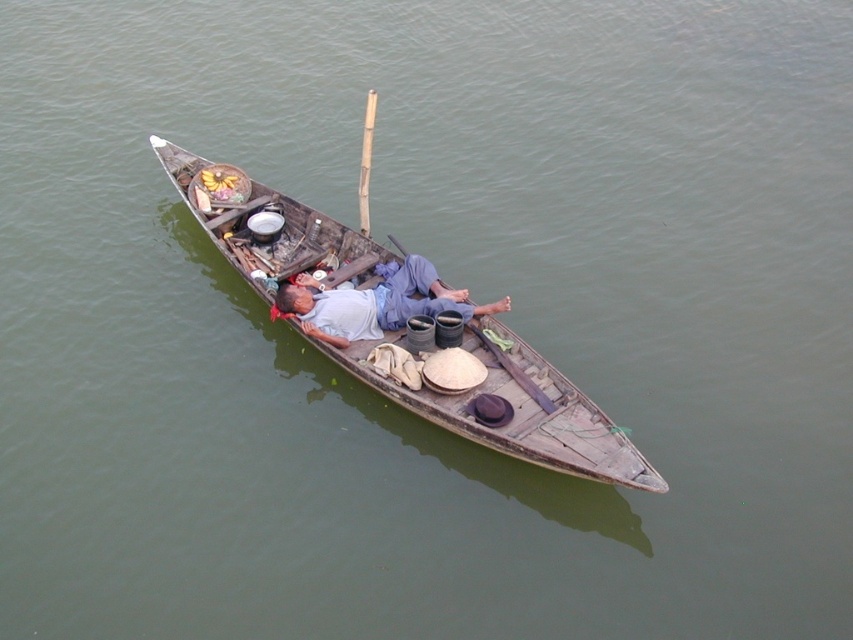
The image size is (853, 640). Identify the location of wooden boat at center. (515, 408).

Is the position of wooden boat at center less distant than that of gray fabric shirt at center?

That is True.

Measure the distance between wooden boat at center and camera.

They are 10.81 meters apart.

Identify the location of wooden boat at center. The height and width of the screenshot is (640, 853). (515, 408).